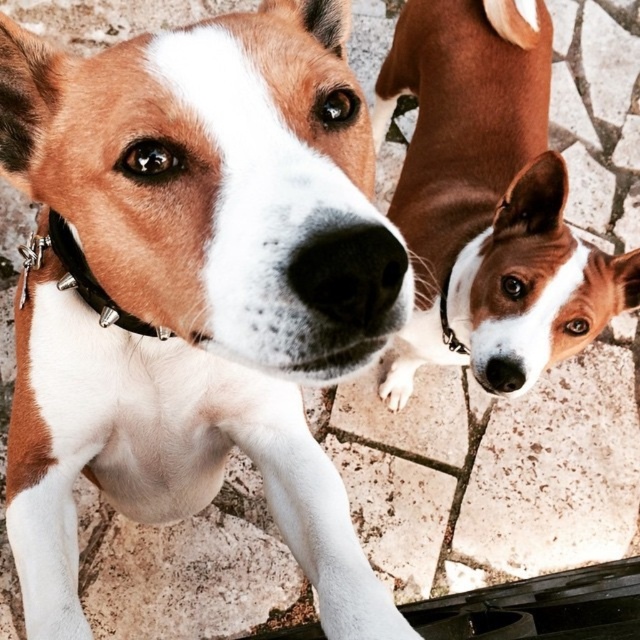
You are a photographer trying to capture a closeup of the black rubber nose at upper center. You notice a white soft fur paw at upper right in your frame. Based on their positions, will the paw be blocking the nose in the photo?

The white soft fur paw at upper right is located below the black rubber nose at upper center, so it will not block the nose in the photo.

Where is the brown and white fur at center located in the image?

The brown and white fur at center is located at point coordinates of (195, 289).